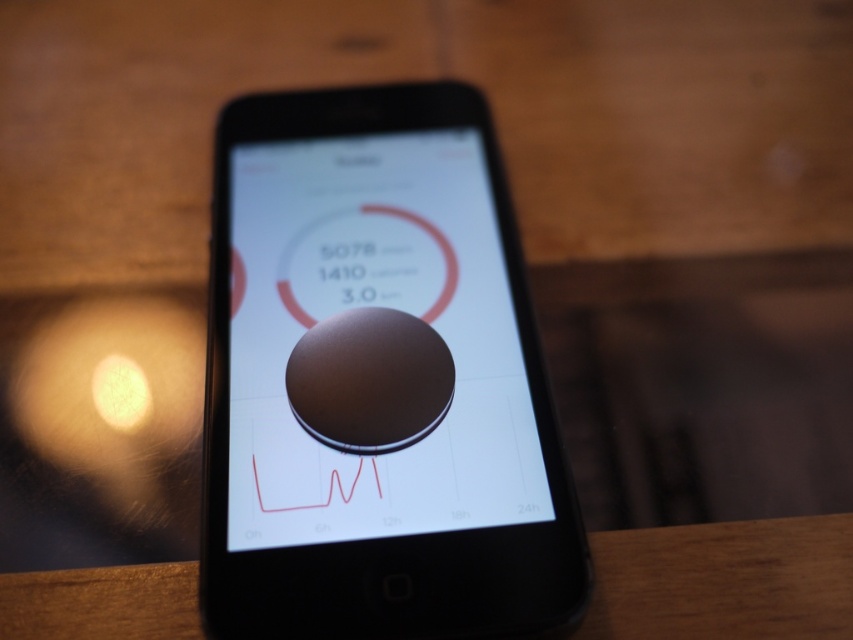
What are the coordinates of the matte brown circle at center on the phone screen?

The coordinates of the matte brown circle at center are at point (373, 305).

You are designing a new app layout for a fitness tracker. The current design has a matte brown circle at center at point (373, 305). You want to place a new rectangular button that will be 0.1 units taller than the matte brown circle at center. Where should the new button be placed to align with the existing layout?

The new rectangular button should be placed at the same center point as the matte brown circle at center, which is at (373, 305), to maintain alignment. Since it is 0.1 units taller, it will extend equally above and below the original circle while keeping the center point consistent.

You are looking at a smartphone on a wooden table. You see a matte brown circle at center and a wooden table at center. Which object is positioned to the right?

The wooden table at center is positioned to the right of the matte brown circle at center.